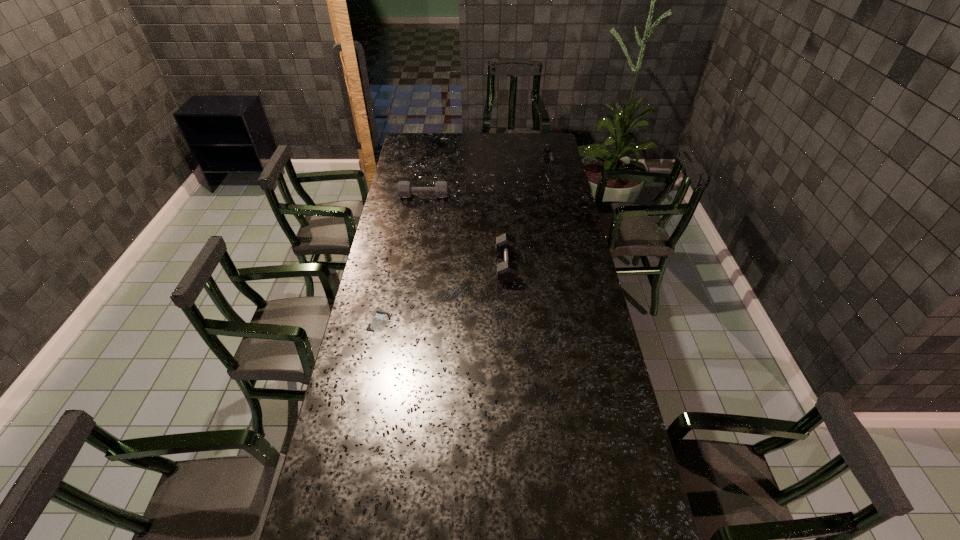
Image resolution: width=960 pixels, height=540 pixels. I want to click on object that can be found as the second closest to the rightmost object, so click(507, 271).

Identify the location of the second closest object relative to the second farthest object. (554, 170).

Select which dumbbell appears as the closest to the leftmost dumbbell. Please provide its 2D coordinates. Your answer should be formatted as a tuple, i.e. [(x, y)], where the tuple contains the x and y coordinates of a point satisfying the conditions above.

[(507, 271)]

Identify which dumbbell is the second closest to the second nearest object. Please provide its 2D coordinates. Your answer should be formatted as a tuple, i.e. [(x, y)], where the tuple contains the x and y coordinates of a point satisfying the conditions above.

[(554, 170)]

The image size is (960, 540). I want to click on vacant position in the image that satisfies the following two spatial constraints: 1. on the back side of the leftmost dumbbell; 2. on the right side of the identity card, so (x=405, y=196).